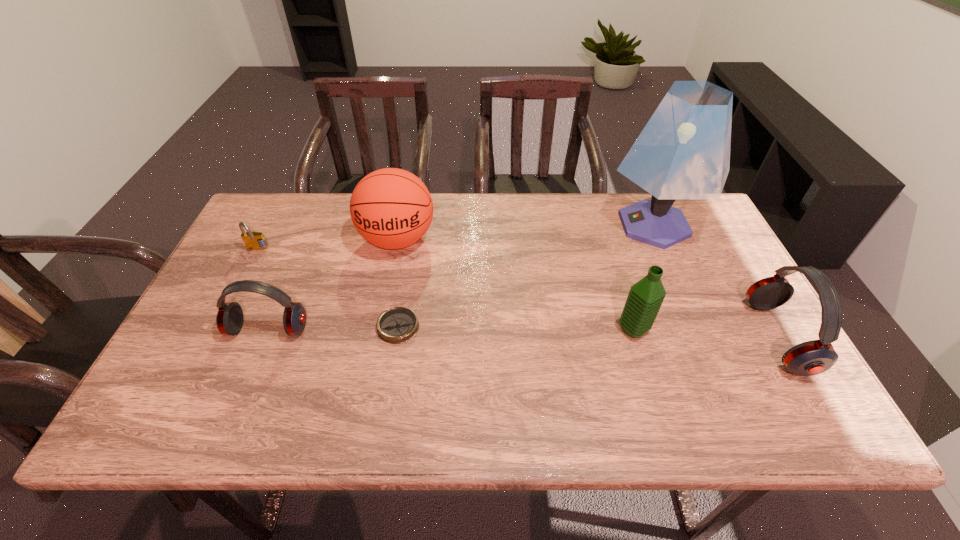
Identify the location of the left earphone. (229, 319).

Locate an element on the screen. The image size is (960, 540). the third shortest object is located at coordinates (229, 319).

Identify the location of the taller earphone. The height and width of the screenshot is (540, 960). (813, 357).

What are the coordinates of `lampshade` in the screenshot? It's located at (683, 152).

This screenshot has width=960, height=540. In order to click on padlock in this screenshot , I will do `click(253, 240)`.

Where is `basketball`? The width and height of the screenshot is (960, 540). basketball is located at coordinates (391, 208).

Where is `compass`? The height and width of the screenshot is (540, 960). compass is located at coordinates (397, 325).

At what (x,y) coordinates should I click in order to perform the action: click on water bottle. Please return your answer as a coordinate pair (x, y). This screenshot has height=540, width=960. Looking at the image, I should click on (645, 297).

I want to click on free space located on the ear cups of the shorter earphone, so click(x=248, y=380).

Locate an element on the screen. free space located 0.290m on the base of the tallest object is located at coordinates (509, 225).